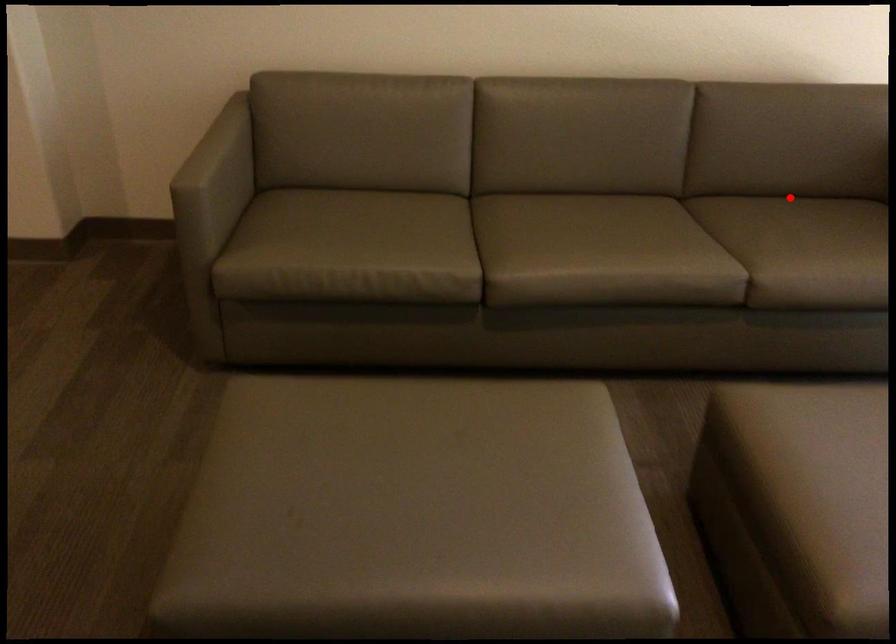
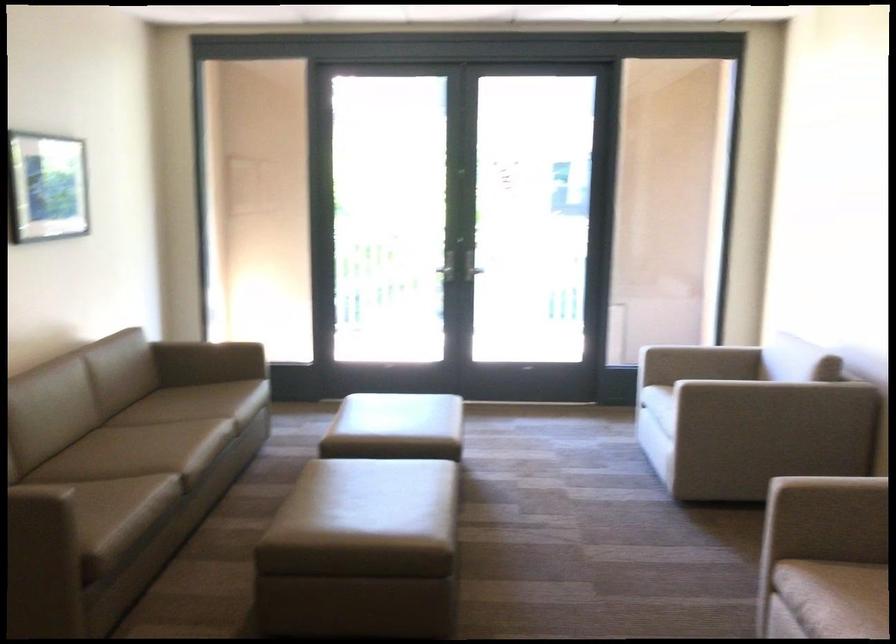
Where in the second image is the point corresponding to the highlighted location from the first image?

(122, 399)